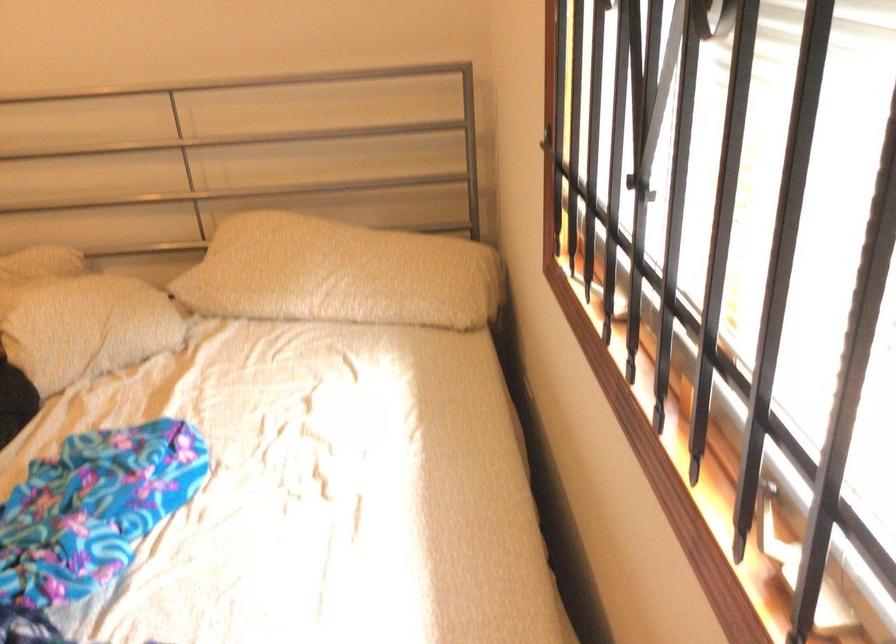
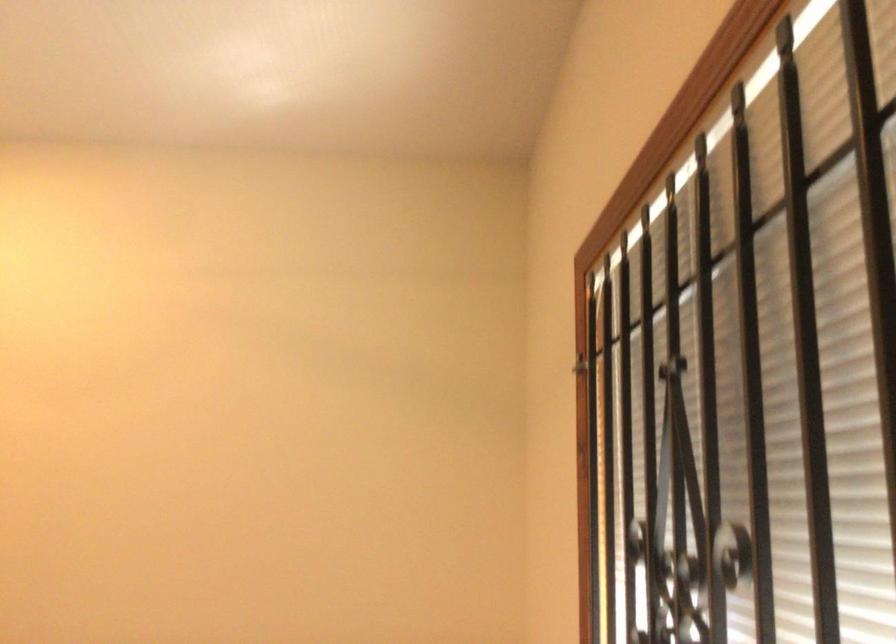
Question: How did the camera likely rotate?

Choices:
 (A) Left
 (B) Right
 (C) Up
 (D) Down

Answer: (C)